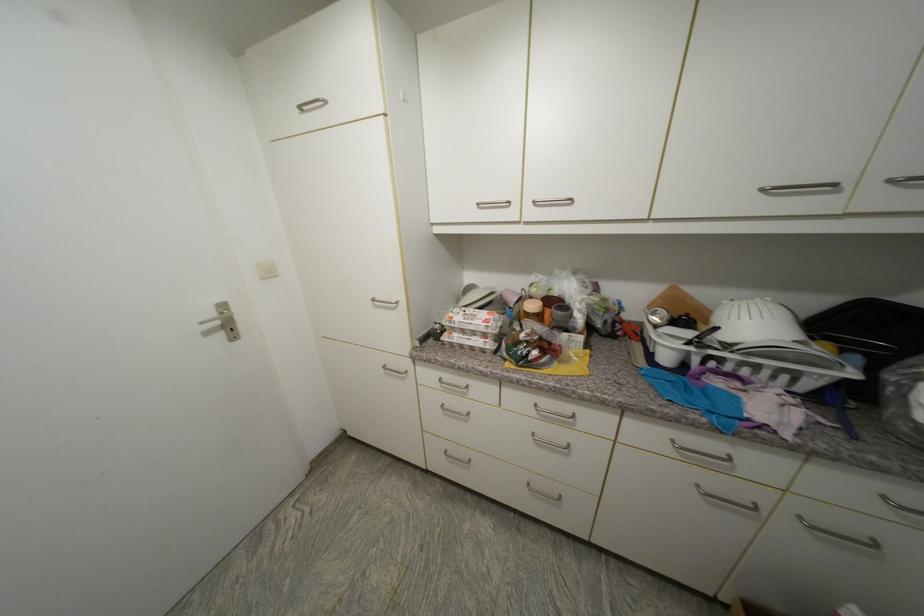
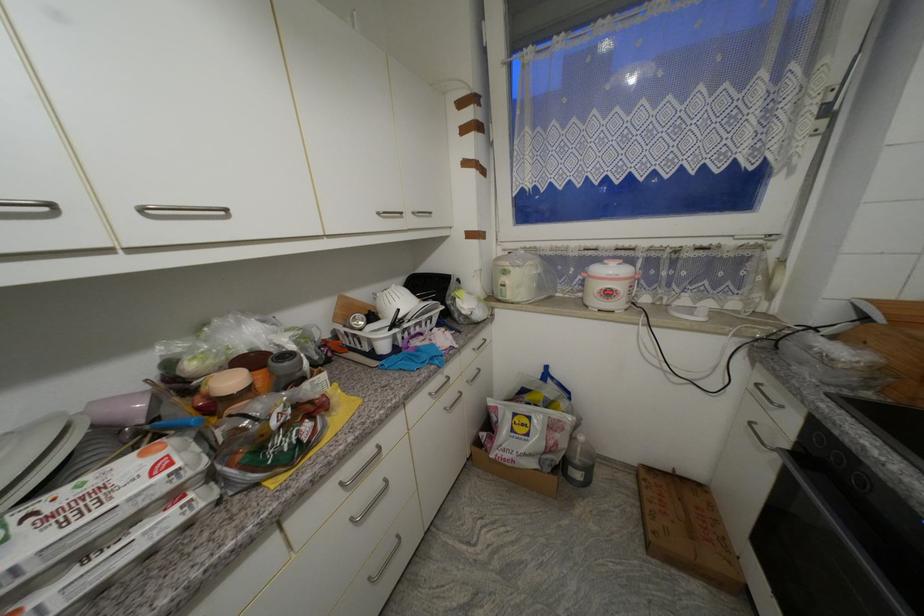
Locate, in the second image, the point that corresponds to [490,337] in the first image.

(178, 498)